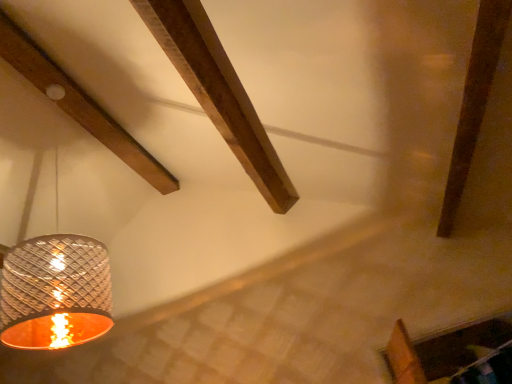
Question: From the image's perspective, does metallic textured lampshade at left appear lower than wooden beam at upper left?

Choices:
 (A) yes
 (B) no

Answer: (A)

Question: From the image's perspective, is metallic textured lampshade at left above wooden beam at upper left?

Choices:
 (A) no
 (B) yes

Answer: (A)

Question: Considering the relative positions of metallic textured lampshade at left and wooden beam at upper left in the image provided, is metallic textured lampshade at left behind wooden beam at upper left?

Choices:
 (A) yes
 (B) no

Answer: (B)

Question: Considering the relative sizes of metallic textured lampshade at left and wooden beam at upper left in the image provided, is metallic textured lampshade at left smaller than wooden beam at upper left?

Choices:
 (A) yes
 (B) no

Answer: (B)

Question: Is the depth of metallic textured lampshade at left less than that of wooden beam at upper left?

Choices:
 (A) no
 (B) yes

Answer: (B)

Question: Can you confirm if metallic textured lampshade at left is shorter than wooden beam at upper left?

Choices:
 (A) no
 (B) yes

Answer: (A)

Question: Is wooden beam at upper left positioned far away from metallic textured lampshade at left?

Choices:
 (A) no
 (B) yes

Answer: (B)

Question: Considering the relative positions of wooden beam at upper left and metallic textured lampshade at left in the image provided, is wooden beam at upper left to the left of metallic textured lampshade at left from the viewer's perspective?

Choices:
 (A) no
 (B) yes

Answer: (B)

Question: From the image's perspective, is wooden beam at upper left above metallic textured lampshade at left?

Choices:
 (A) no
 (B) yes

Answer: (B)

Question: From a real-world perspective, is wooden beam at upper left on top of metallic textured lampshade at left?

Choices:
 (A) no
 (B) yes

Answer: (B)

Question: Is wooden beam at upper left placed right next to metallic textured lampshade at left?

Choices:
 (A) yes
 (B) no

Answer: (B)

Question: Does wooden beam at upper left have a greater height compared to metallic textured lampshade at left?

Choices:
 (A) yes
 (B) no

Answer: (B)

Question: From the image's perspective, is metallic textured lampshade at left positioned above or below wooden beam at upper left?

Choices:
 (A) above
 (B) below

Answer: (B)